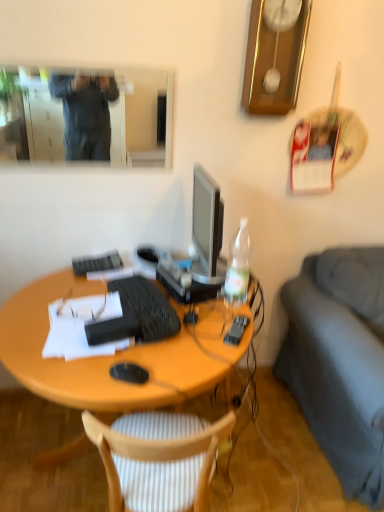
Find the location of a particular element. vacant space to the left of white paper at center is located at coordinates (28, 320).